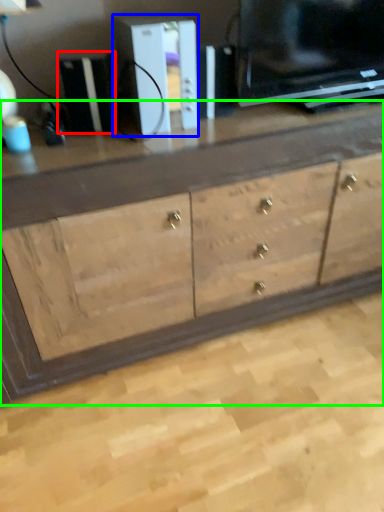
Question: Considering the real-world distances, which object is farthest from appliance (highlighted by a red box)? appliance (highlighted by a blue box) or chest of drawers (highlighted by a green box)?

Choices:
 (A) appliance
 (B) chest of drawers

Answer: (B)